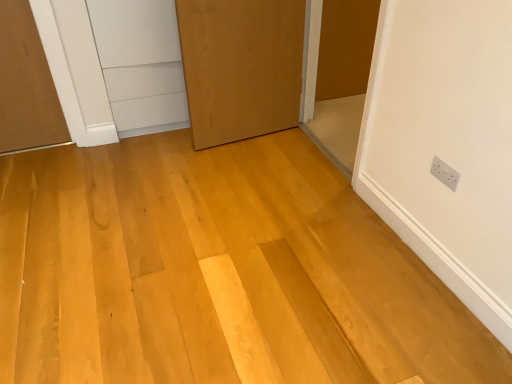
Question: Is white plastic electric outlet at upper right facing towards wooden door at center, arranged as the 2th door when viewed from the right?

Choices:
 (A) no
 (B) yes

Answer: (A)

Question: Does white plastic electric outlet at upper right appear on the right side of wooden door at center, arranged as the 2th door when viewed from the right?

Choices:
 (A) yes
 (B) no

Answer: (A)

Question: Is white plastic electric outlet at upper right further to camera compared to wooden door at center, the 1th door when ordered from left to right?

Choices:
 (A) yes
 (B) no

Answer: (B)

Question: Considering the relative sizes of white plastic electric outlet at upper right and wooden door at center, the 1th door when ordered from left to right, in the image provided, is white plastic electric outlet at upper right smaller than wooden door at center, the 1th door when ordered from left to right,?

Choices:
 (A) no
 (B) yes

Answer: (B)

Question: From a real-world perspective, is white plastic electric outlet at upper right below wooden door at center, arranged as the 2th door when viewed from the right?

Choices:
 (A) yes
 (B) no

Answer: (A)

Question: Considering the positions of natural wood floor at center and white plastic electric outlet at upper right in the image, is natural wood floor at center wider or thinner than white plastic electric outlet at upper right?

Choices:
 (A) thin
 (B) wide

Answer: (B)

Question: Is point (36, 218) positioned closer to the camera than point (451, 188)?

Choices:
 (A) farther
 (B) closer

Answer: (A)

Question: From the image's perspective, is natural wood floor at center positioned above or below white plastic electric outlet at upper right?

Choices:
 (A) below
 (B) above

Answer: (A)

Question: From a real-world perspective, is natural wood floor at center positioned above or below white plastic electric outlet at upper right?

Choices:
 (A) above
 (B) below

Answer: (B)

Question: Would you say white plastic electric outlet at upper right is to the left or to the right of matte brown door at upper right, which is the 2th door in left-to-right order, in the picture?

Choices:
 (A) right
 (B) left

Answer: (A)

Question: From a real-world perspective, is white plastic electric outlet at upper right physically located above or below matte brown door at upper right, which is the 2th door in left-to-right order?

Choices:
 (A) above
 (B) below

Answer: (A)

Question: Considering the positions of white plastic electric outlet at upper right and matte brown door at upper right, which is counted as the first door, starting from the right, in the image, is white plastic electric outlet at upper right wider or thinner than matte brown door at upper right, which is counted as the first door, starting from the right,?

Choices:
 (A) thin
 (B) wide

Answer: (A)

Question: Is white plastic electric outlet at upper right situated inside matte brown door at upper right, which is the 2th door in left-to-right order, or outside?

Choices:
 (A) inside
 (B) outside

Answer: (B)

Question: From the image's perspective, is natural wood floor at center above or below matte brown door at upper right, which is the 2th door in left-to-right order?

Choices:
 (A) below
 (B) above

Answer: (A)

Question: Considering the positions of point (142, 236) and point (323, 79), is point (142, 236) closer or farther from the camera than point (323, 79)?

Choices:
 (A) farther
 (B) closer

Answer: (B)